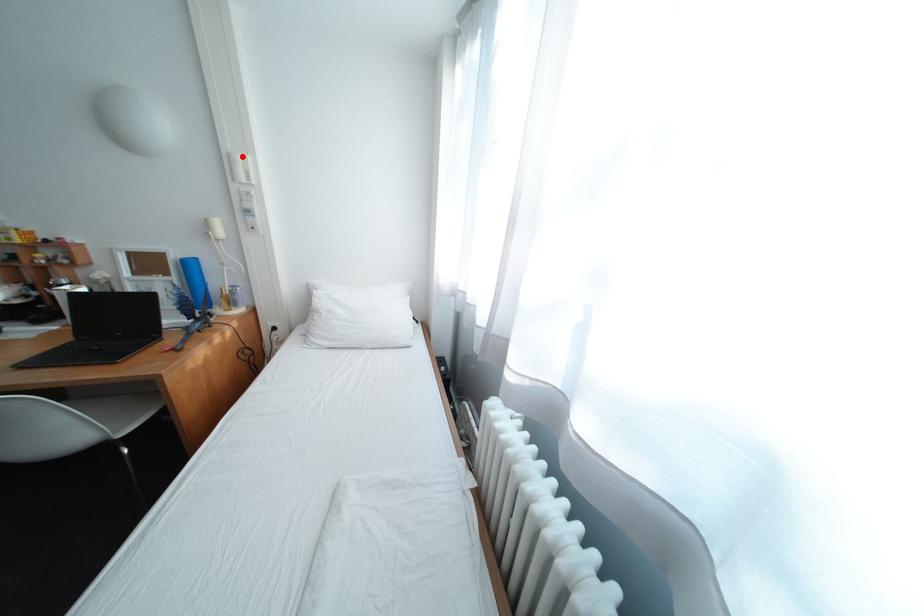
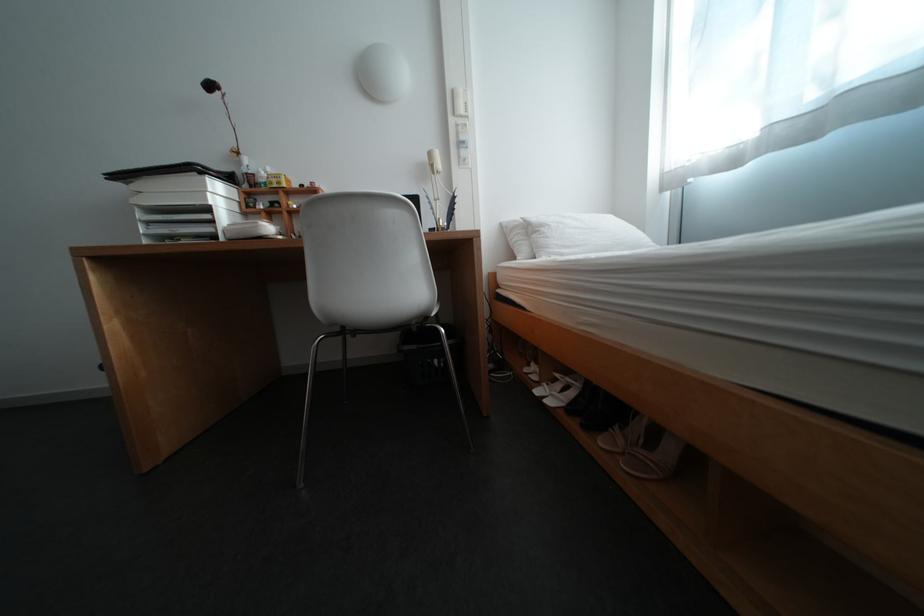
Find the pixel in the second image that matches the highlighted location in the first image.

(466, 92)